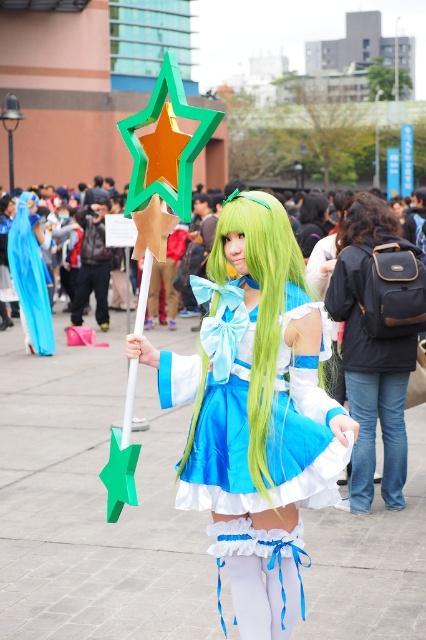
Question: Does matte blue dress at center appear on the right side of dark brown curly hair at center?

Choices:
 (A) no
 (B) yes

Answer: (A)

Question: Can you confirm if black leather backpack at right is bigger than green silky hair at center?

Choices:
 (A) yes
 (B) no

Answer: (A)

Question: Does green silky hair at center appear on the right side of dark brown curly hair at center?

Choices:
 (A) no
 (B) yes

Answer: (A)

Question: Which point is farther from the camera taking this photo?

Choices:
 (A) (353, 220)
 (B) (351, 227)

Answer: (B)

Question: Which of the following is the farthest from the observer?

Choices:
 (A) (348, 355)
 (B) (360, 204)
 (C) (282, 228)
 (D) (288, 241)

Answer: (B)

Question: Which point is closer to the camera taking this photo?

Choices:
 (A) (359, 214)
 (B) (253, 346)

Answer: (B)